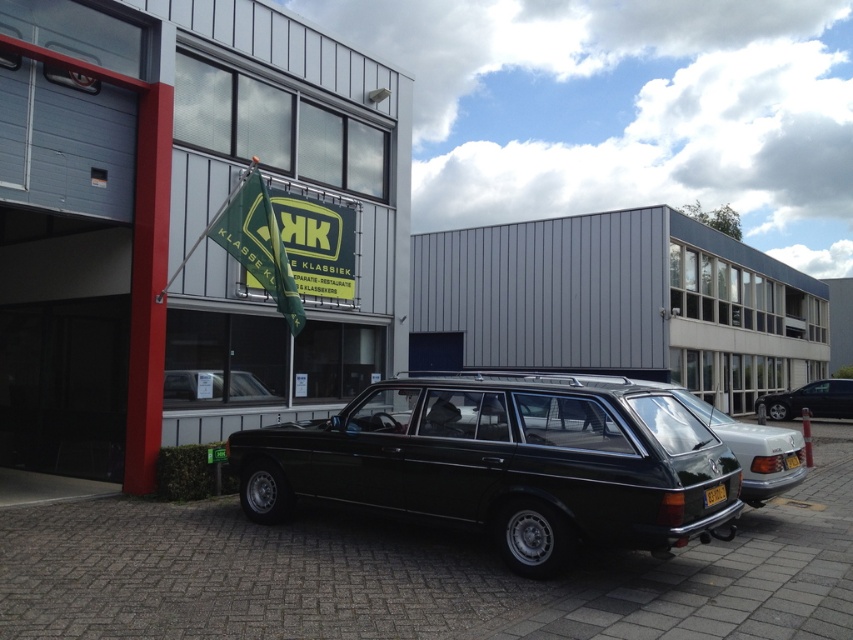
Question: Which of these objects is positioned farthest from the yellow matte license plate at rear?

Choices:
 (A) yellow plastic license plate at center
 (B) shiny black station wagon at right
 (C) shiny black station wagon at center
 (D) black metallic station wagon at center

Answer: (B)

Question: Which point appears closest to the camera in this image?

Choices:
 (A) (848, 412)
 (B) (724, 493)
 (C) (264, 518)
 (D) (231, 388)

Answer: (B)

Question: Is shiny black station wagon at center smaller than shiny black station wagon at right?

Choices:
 (A) yes
 (B) no

Answer: (B)

Question: From the image, what is the correct spatial relationship of black metallic station wagon at center in relation to yellow plastic license plate at center?

Choices:
 (A) right
 (B) left

Answer: (B)

Question: Is black metallic station wagon at center further to the viewer compared to shiny black station wagon at center?

Choices:
 (A) no
 (B) yes

Answer: (A)

Question: Which point is closer to the camera?

Choices:
 (A) (444, 392)
 (B) (791, 454)
 (C) (724, 488)
 (D) (798, 387)

Answer: (C)